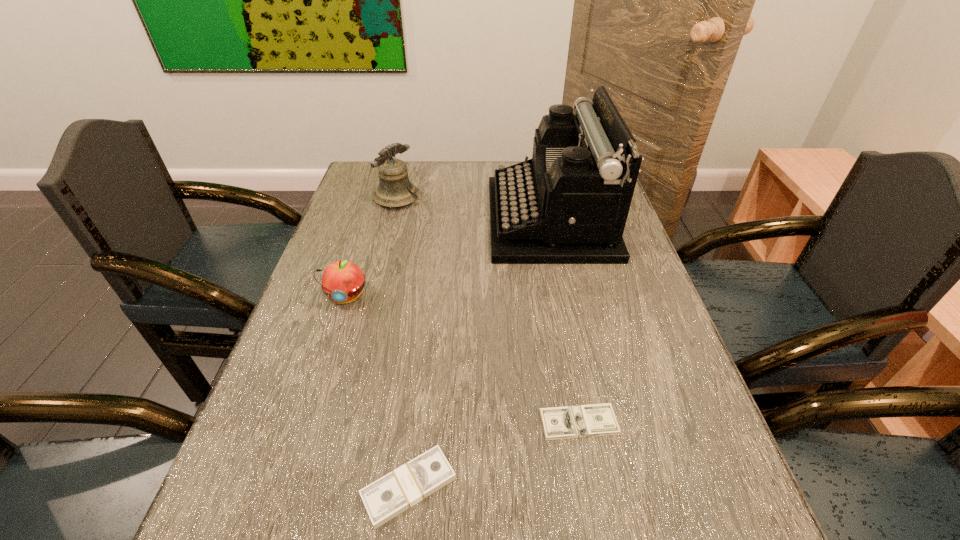
Where is `object present at the far left corner`? This screenshot has height=540, width=960. object present at the far left corner is located at coordinates (394, 190).

The height and width of the screenshot is (540, 960). I want to click on object positioned at the far right corner, so click(569, 204).

In the image, there is a desktop. Find the location of `blank space at the left edge`. blank space at the left edge is located at coordinates (230, 523).

Find the location of `free region at the right edge`. free region at the right edge is located at coordinates (612, 360).

You are a GUI agent. You are given a task and a screenshot of the screen. Output one action in this format:
    pyautogui.click(x=<x>, y=<y>)
    Task: Click on the vacant area that lies between the third shortest object and the shorter dollar
    
    Given the screenshot: What is the action you would take?
    pyautogui.click(x=462, y=359)

This screenshot has height=540, width=960. Identify the location of vacant area that lies between the fourth tallest object and the typewriter. (480, 353).

Identify the location of vacant area between the fourth shortest object and the left dollar. (403, 343).

At what (x,y) coordinates should I click in order to perform the action: click on empty location between the typewriter and the fourth tallest object. Please return your answer as a coordinate pair (x, y). This screenshot has width=960, height=540. Looking at the image, I should click on (480, 353).

Image resolution: width=960 pixels, height=540 pixels. In order to click on free spot between the taller dollar and the typewriter in this screenshot , I will do `click(480, 353)`.

You are a GUI agent. You are given a task and a screenshot of the screen. Output one action in this format:
    pyautogui.click(x=<x>, y=<y>)
    Task: Click on the free space between the fourth tallest object and the bell
    The image size is (960, 540).
    Given the screenshot: What is the action you would take?
    coord(403,343)